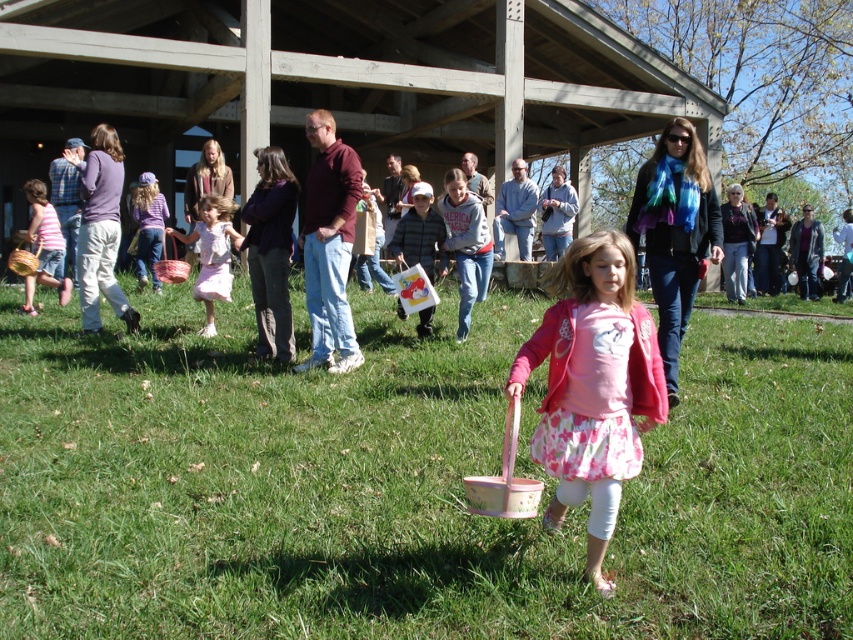
Question: Does green grass at center appear on the left side of pink fabric dress at center?

Choices:
 (A) no
 (B) yes

Answer: (A)

Question: Is green grass at center below matte pink dress at left?

Choices:
 (A) yes
 (B) no

Answer: (A)

Question: Among these points, which one is nearest to the camera?

Choices:
 (A) (596, 340)
 (B) (45, 250)
 (C) (183, 236)
 (D) (247, 384)

Answer: (A)

Question: Which object is farther from the camera taking this photo?

Choices:
 (A) green grass at center
 (B) pink floral skirt at center

Answer: (B)

Question: Considering the relative positions of pink floral skirt at center and matte pink dress at left in the image provided, where is pink floral skirt at center located with respect to matte pink dress at left?

Choices:
 (A) above
 (B) below

Answer: (B)

Question: Which object appears closest to the camera in this image?

Choices:
 (A) matte pink dress at left
 (B) green grass at center
 (C) pink floral skirt at center
 (D) pink fabric dress at center

Answer: (B)